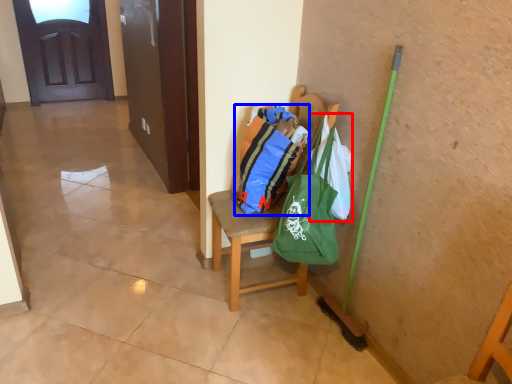
Question: Which object appears closest to the camera in this image, grocery bag (highlighted by a red box) or shopping bag (highlighted by a blue box)?

Choices:
 (A) grocery bag
 (B) shopping bag

Answer: (A)